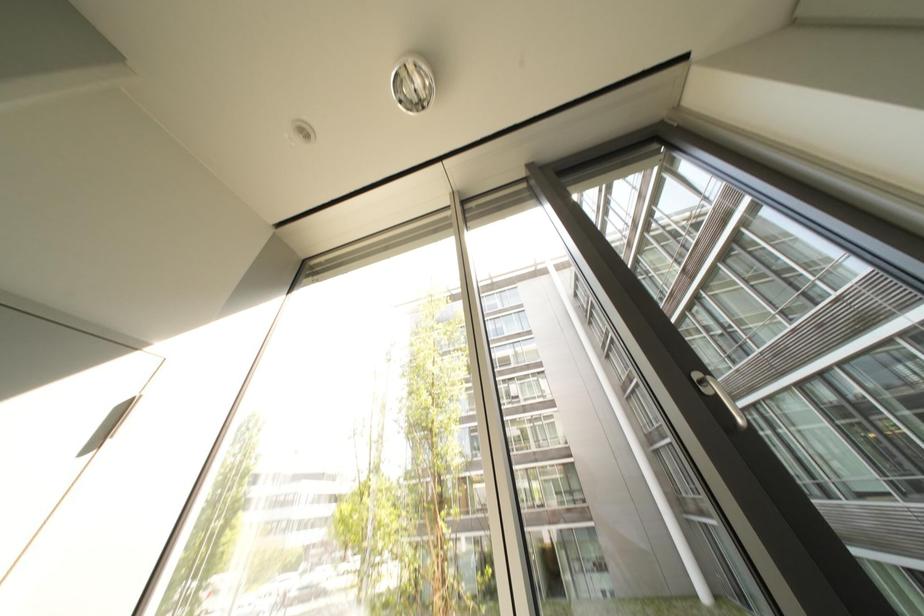
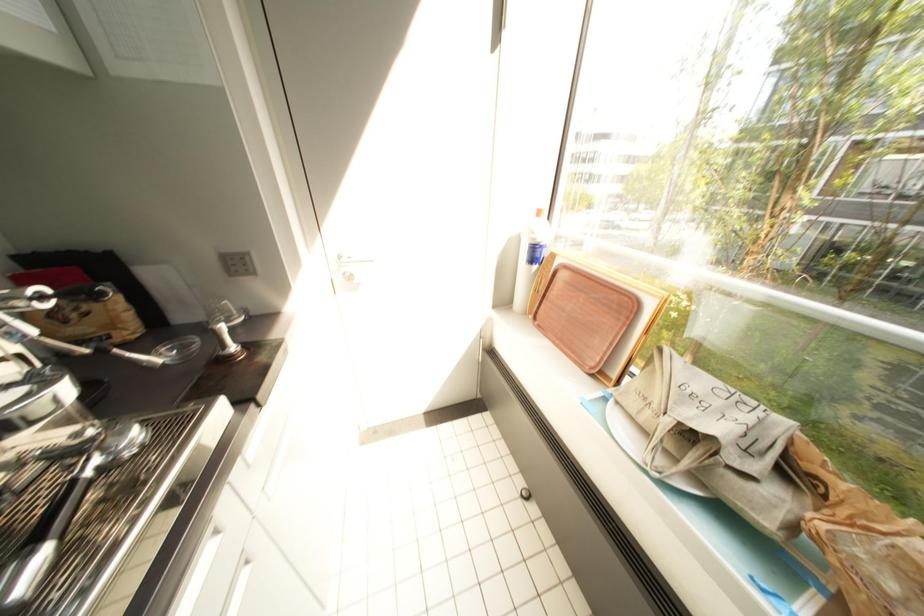
The images are taken continuously from a first-person perspective. In which direction is your viewpoint rotating?

The camera's rotation is toward left-down.